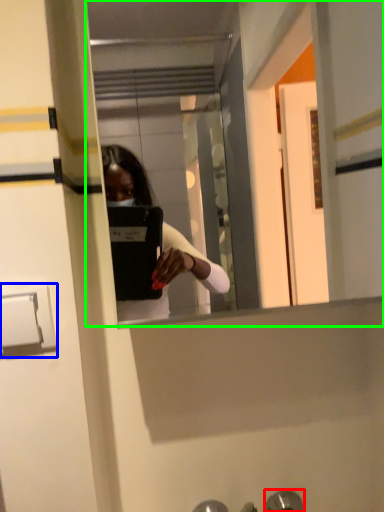
Question: Which object is the farthest from door handle (highlighted by a red box)? Choose among these: door handle (highlighted by a blue box) or mirror (highlighted by a green box).

Choices:
 (A) door handle
 (B) mirror

Answer: (B)